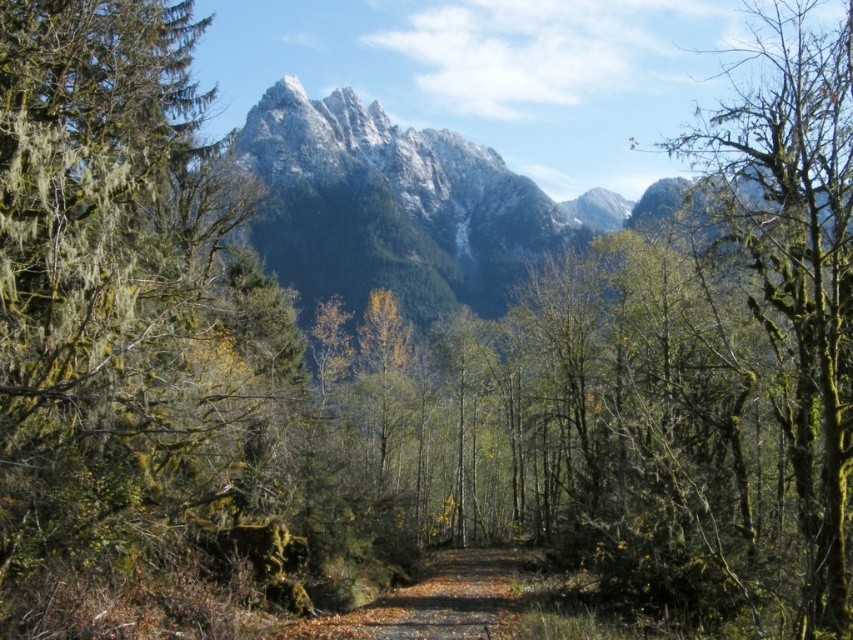
Is snowy granite mountain at upper center further to camera compared to brown wooden path at center?

Yes, it is behind brown wooden path at center.

Where is `snowy granite mountain at upper center`? The width and height of the screenshot is (853, 640). snowy granite mountain at upper center is located at coordinates (393, 205).

Is green mossy tree at right smaller than snowy granite mountain at upper center?

No, green mossy tree at right is not smaller than snowy granite mountain at upper center.

Is green mossy tree at right to the right of snowy granite mountain at upper center from the viewer's perspective?

Correct, you'll find green mossy tree at right to the right of snowy granite mountain at upper center.

Which is behind, point (730, 241) or point (273, 256)?

Point (273, 256)

The width and height of the screenshot is (853, 640). I want to click on green mossy tree at right, so click(793, 264).

Between point (107, 524) and point (795, 90), which one is positioned in front?

Point (107, 524)

Does point (239, 221) lie in front of point (802, 358)?

No, it is behind (802, 358).

I want to click on green mossy tree at left, so click(x=112, y=284).